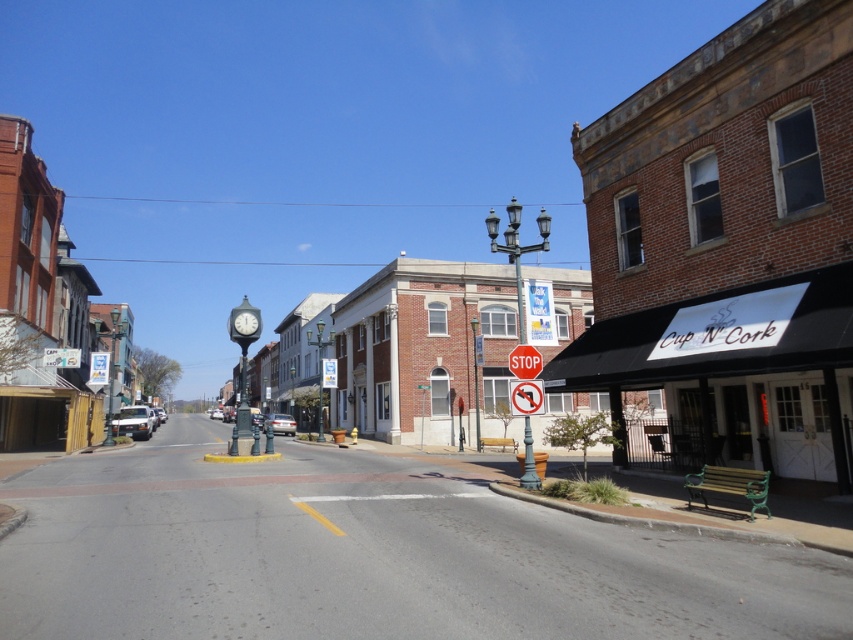
Question: Can you confirm if metallic pole at center-right is smaller than red matte stop sign at center?

Choices:
 (A) no
 (B) yes

Answer: (A)

Question: Which of the following is the farthest from the observer?

Choices:
 (A) (521, 348)
 (B) (515, 403)

Answer: (A)

Question: Which object is closer to the camera taking this photo?

Choices:
 (A) red plastic stop sign at center
 (B) brick building at left
 (C) red matte stop sign at center
 (D) metallic pole at center-right

Answer: (A)

Question: Does brick building at left have a larger size compared to red plastic stop sign at center?

Choices:
 (A) yes
 (B) no

Answer: (A)

Question: Estimate the real-world distances between objects in this image. Which object is closer to the red plastic stop sign at center?

Choices:
 (A) brick building at left
 (B) red matte stop sign at center
 (C) metallic pole at center-right

Answer: (B)

Question: Is metallic pole at center-right to the right of red plastic stop sign at center from the viewer's perspective?

Choices:
 (A) no
 (B) yes

Answer: (B)